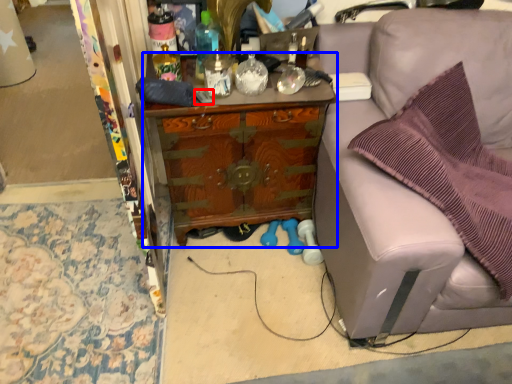
Question: Which of the following is the farthest to the observer, remote control (highlighted by a red box) or cabinetry (highlighted by a blue box)?

Choices:
 (A) remote control
 (B) cabinetry

Answer: (A)